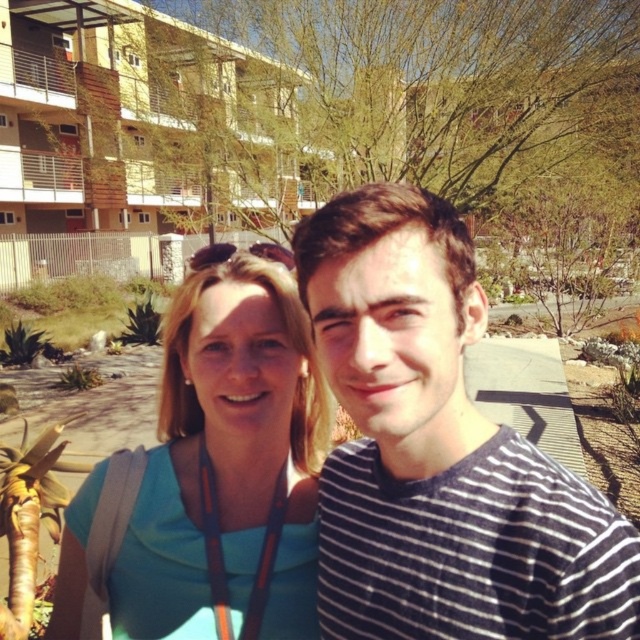
You are standing in front of the scene described. You want to hand a small item to the person wearing the striped cotton shirt at center without moving closer. Can you reach them by extending your arm? Assume your arm can reach 36 inches.

The striped cotton shirt at center is 38.28 inches away from the viewer. Since your arm can only reach 36 inches, you cannot reach them without moving closer.

You are a photographer trying to focus on the striped cotton shirt at center and the blue fabric shirt at center in the image. Which shirt should you adjust your camera to focus on first if you want to capture both clearly?

You should focus on the striped cotton shirt at center first because it is closer to the viewer than the blue fabric shirt at center, ensuring proper focus before adjusting for the farther one.

You are taking a selfie with two friends in a sunny outdoor setting. You notice two points marked in the image. The first point is at coordinates point (310, 220) and the second point is at point (106, 563). Based on their positions, which point is nearer to the camera?

Point (310, 220) is closer to the camera than point (106, 563).